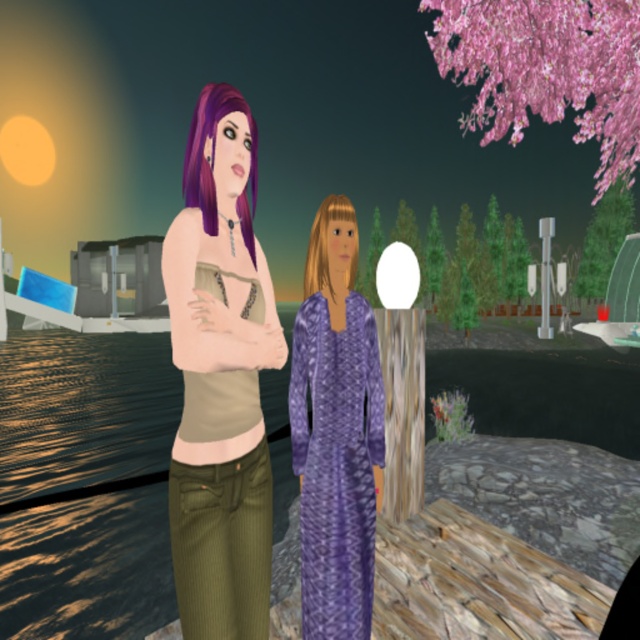
Question: Can you confirm if purple matte hair at center is wider than pink blossom tree at upper right?

Choices:
 (A) yes
 (B) no

Answer: (B)

Question: Which object appears farthest from the camera in this image?

Choices:
 (A) purple matte hair at center
 (B) pink blossom tree at upper right
 (C) green matte tree at center

Answer: (B)

Question: Observing the image, what is the correct spatial positioning of matte green corduroy pants at left in reference to green matte tree at center?

Choices:
 (A) right
 (B) left

Answer: (B)

Question: Which object appears farthest from the camera in this image?

Choices:
 (A) green textured tree at center
 (B) green matte tree at center
 (C) matte green corduroy pants at left

Answer: (A)

Question: Which point is farther from the camera taking this photo?

Choices:
 (A) (580, 298)
 (B) (358, 554)
 (C) (365, 272)

Answer: (A)

Question: Can you confirm if matte green corduroy pants at left is positioned to the right of green textured tree at center?

Choices:
 (A) yes
 (B) no

Answer: (B)